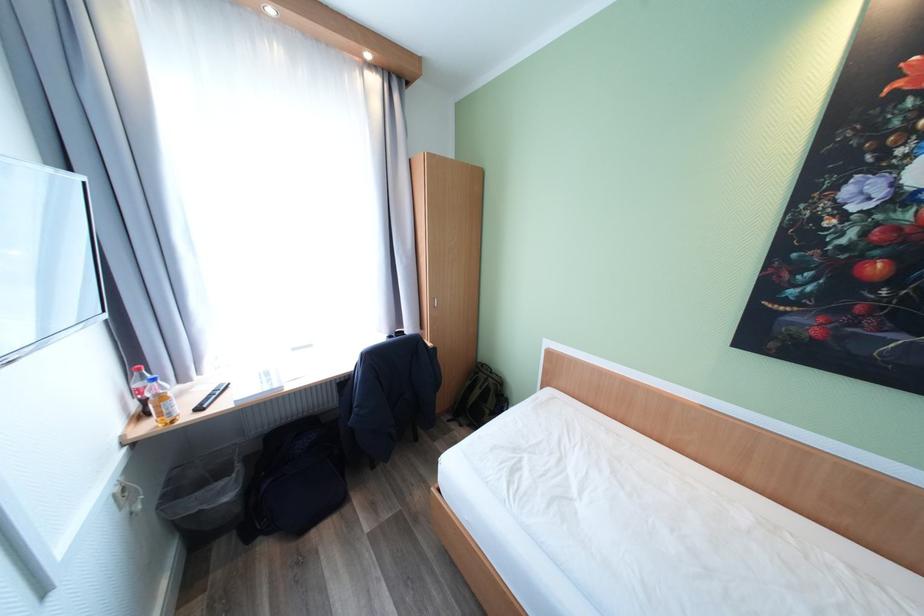
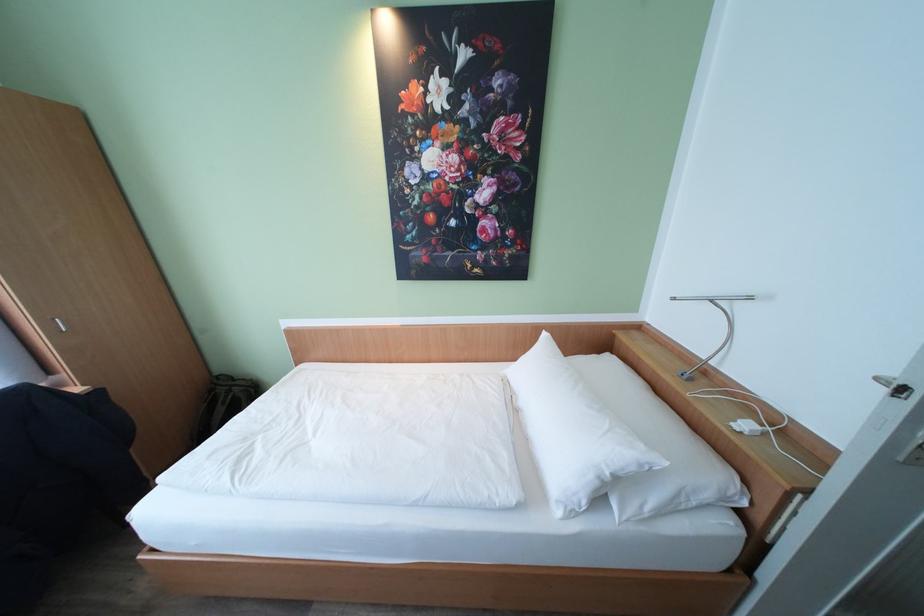
Where in the second image is the point corresponding to point 496,379 from the first image?

(241, 389)